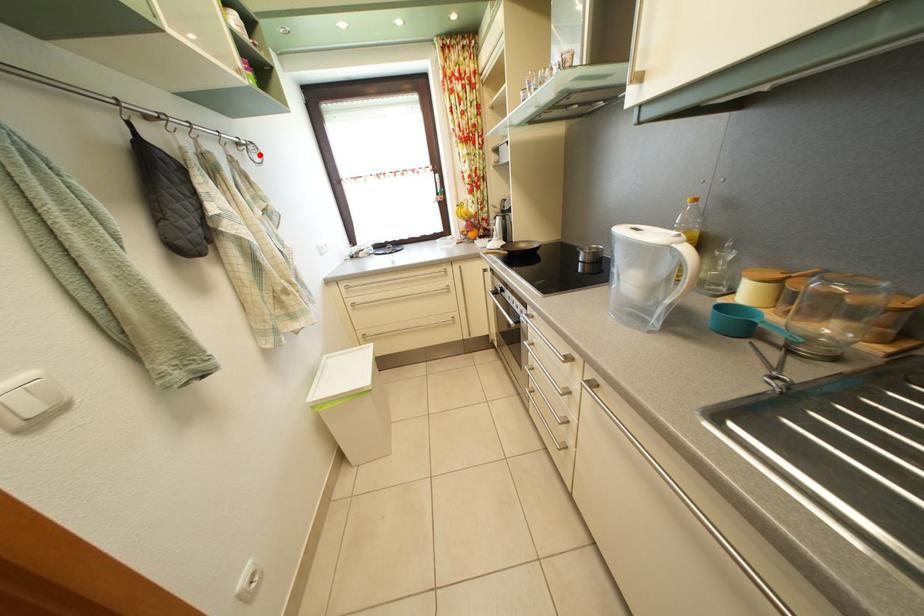
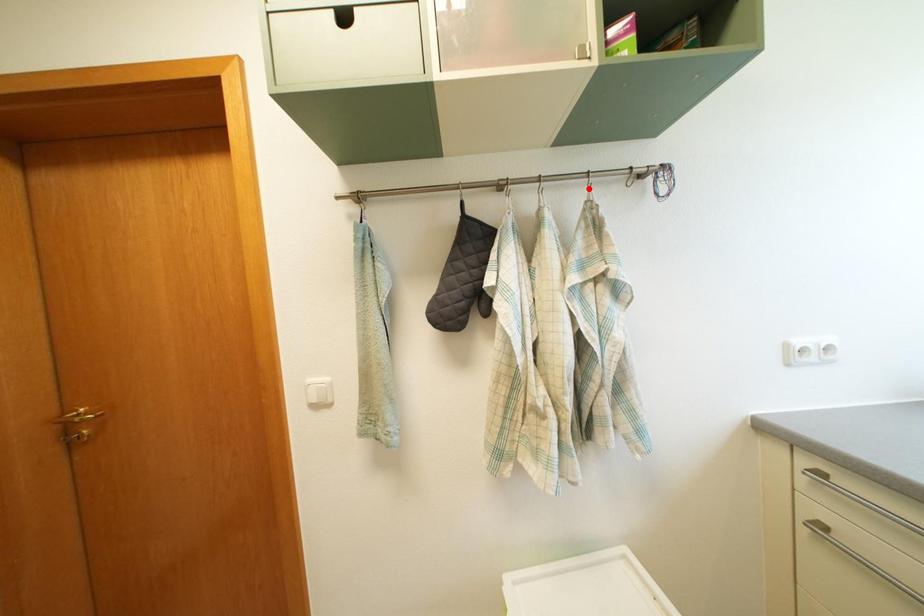
I am providing you with two images of the same scene from different viewpoints. A red point is marked on the first image and another point is marked on the second image. Is the marked point in image1 the same physical position as the marked point in image2?

No